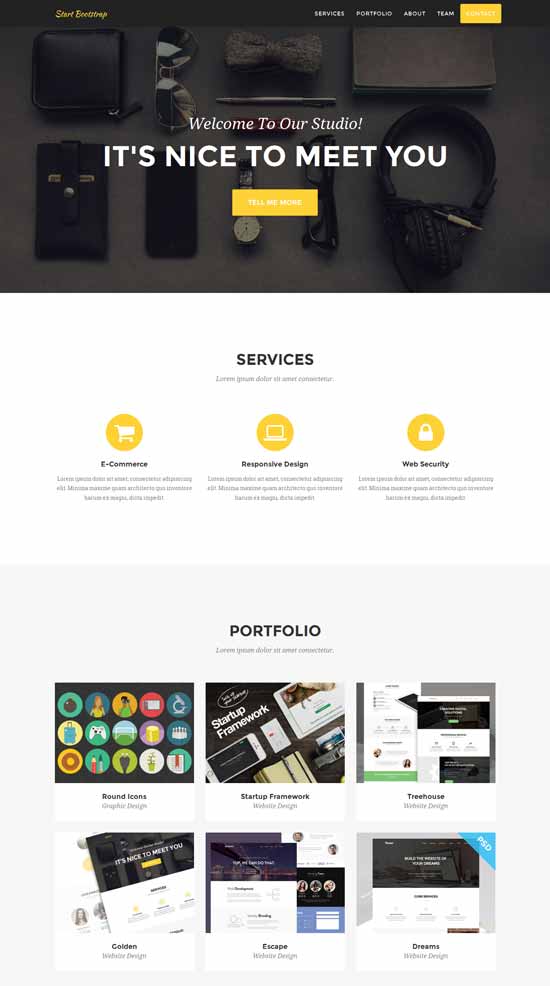
This screenshot has height=986, width=550. What are the coordinates of `lock` in the screenshot? It's located at (429, 432).